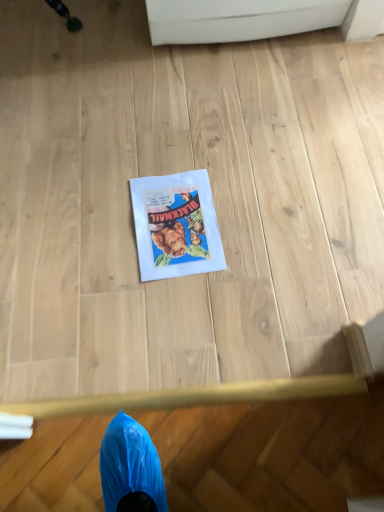
This screenshot has height=512, width=384. In order to click on empty space that is ontop of matte paper coloring book at center (from a real-world perspective) in this screenshot , I will do `click(180, 221)`.